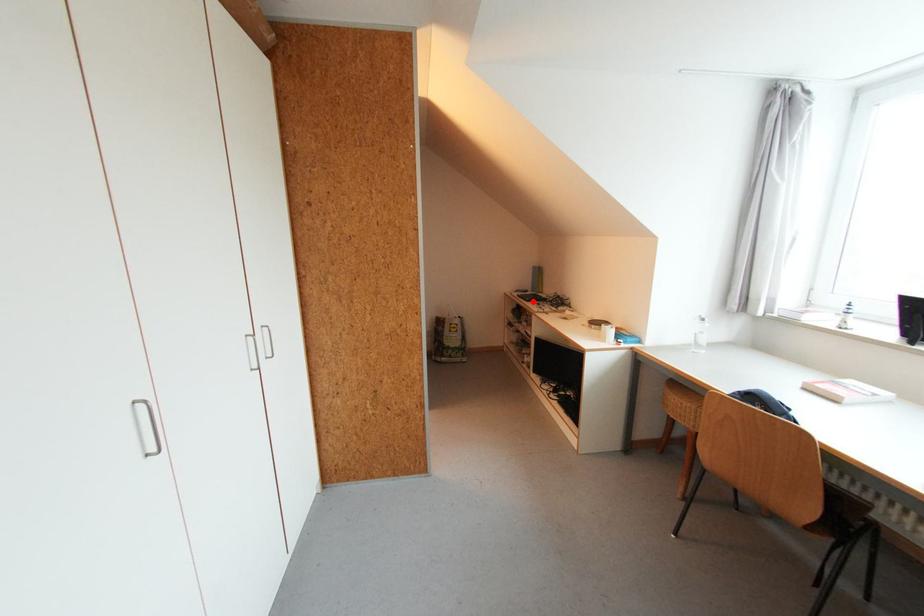
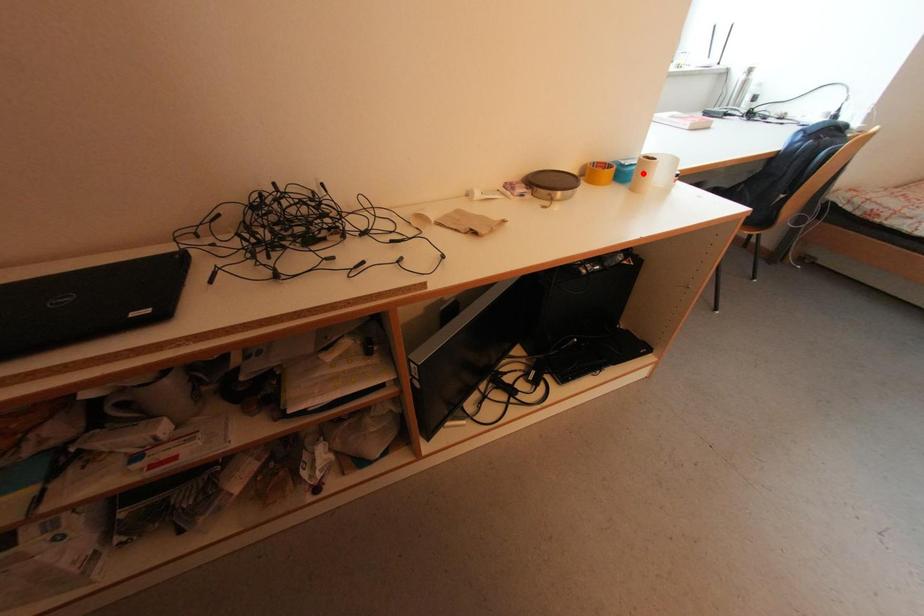
I am providing you with two images of the same scene from different viewpoints. A red point is marked on the first image and another point is marked on the second image. Is the marked point in image1 the same physical position as the marked point in image2?

No